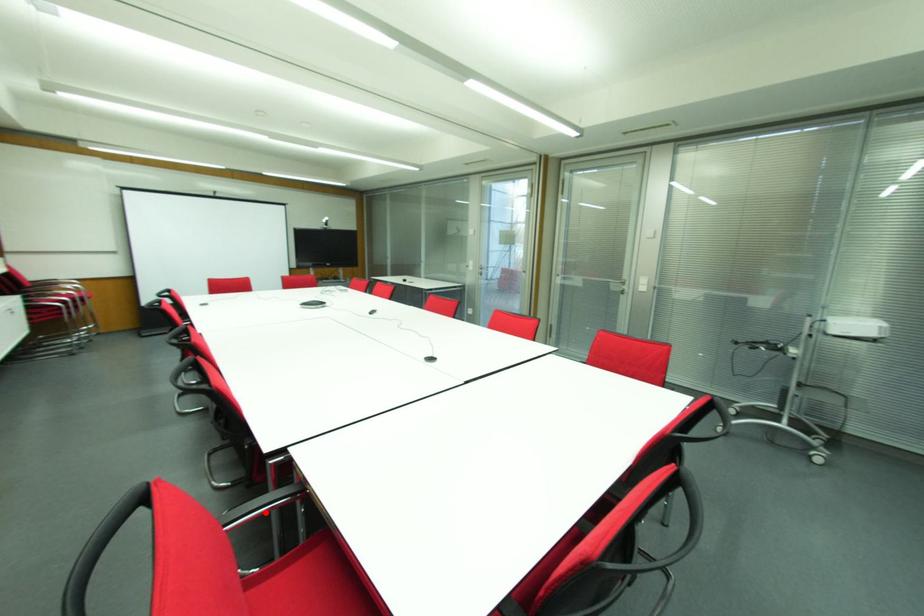
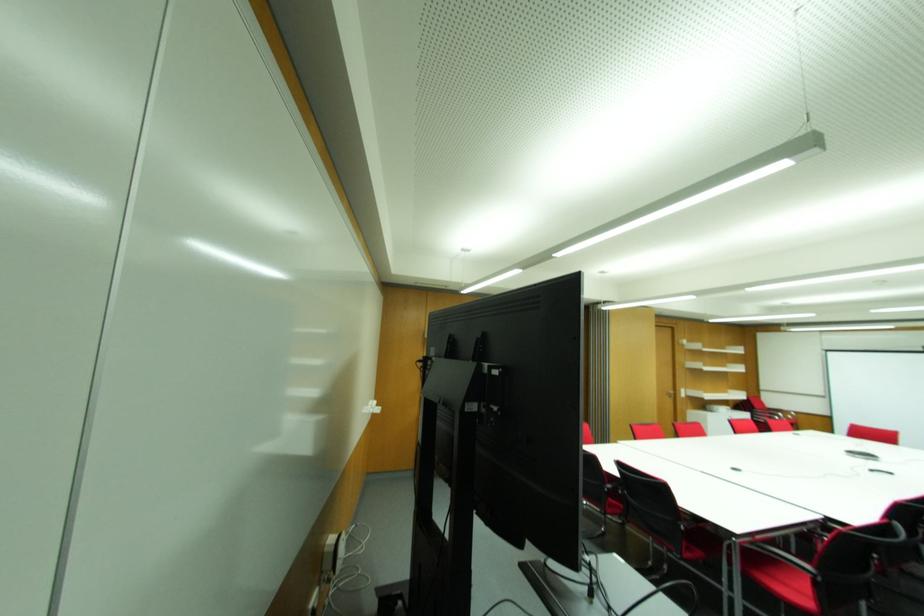
Question: I am providing you with two images of the same scene from different viewpoints. A red point is marked on the first image. At the location where the point appears in image 1, is it still visible in image 2?

Choices:
 (A) Yes
 (B) No

Answer: (B)